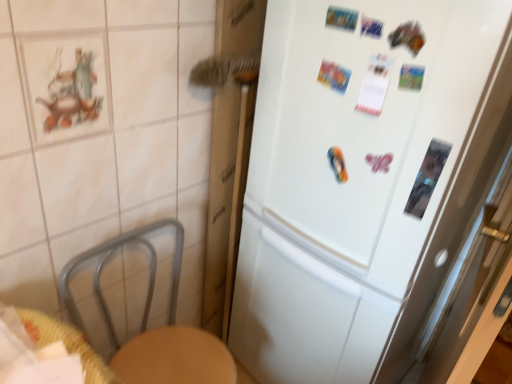
Question: In terms of size, does woven wood table at lower left appear bigger or smaller than white matte refrigerator at center?

Choices:
 (A) small
 (B) big

Answer: (A)

Question: Based on their positions, is woven wood table at lower left located to the left or right of white matte refrigerator at center?

Choices:
 (A) right
 (B) left

Answer: (B)

Question: Considering the real-world distances, which object is closest to the white matte refrigerator at center?

Choices:
 (A) transparent glass screen door at right
 (B) woven wood table at lower left

Answer: (A)

Question: Based on their relative distances, which object is nearer to the white matte refrigerator at center?

Choices:
 (A) woven wood table at lower left
 (B) transparent glass screen door at right

Answer: (B)